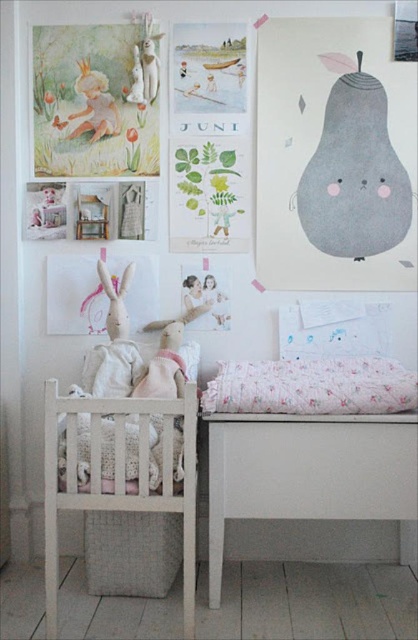
Which of these two, fluffy white pillow at lower center or matte white bunny at upper left, stands taller?

With more height is matte white bunny at upper left.

Looking at this image, does fluffy white pillow at lower center have a smaller size compared to matte white bunny at upper left?

No, fluffy white pillow at lower center is not smaller than matte white bunny at upper left.

Is point (242, 380) less distant than point (106, 104)?

Yes, point (242, 380) is closer to viewer.

Where is `fluffy white pillow at lower center`? The width and height of the screenshot is (418, 640). fluffy white pillow at lower center is located at coordinates (311, 387).

Is white wooden crib at lower left further to the viewer compared to fluffy white pillow at lower center?

No, it is not.

Does point (50, 515) come behind point (385, 371)?

No, it is in front of (385, 371).

Locate an element on the screen. white wooden crib at lower left is located at coordinates (117, 476).

Does white fabric infant bed at lower right appear on the left side of matte white bunny at upper left?

Incorrect, white fabric infant bed at lower right is not on the left side of matte white bunny at upper left.

Between point (352, 422) and point (101, 132), which one is positioned in front?

Point (352, 422) is more forward.

The image size is (418, 640). What do you see at coordinates (306, 472) in the screenshot?
I see `white fabric infant bed at lower right` at bounding box center [306, 472].

Locate an element on the screen. white fabric infant bed at lower right is located at coordinates (306, 472).